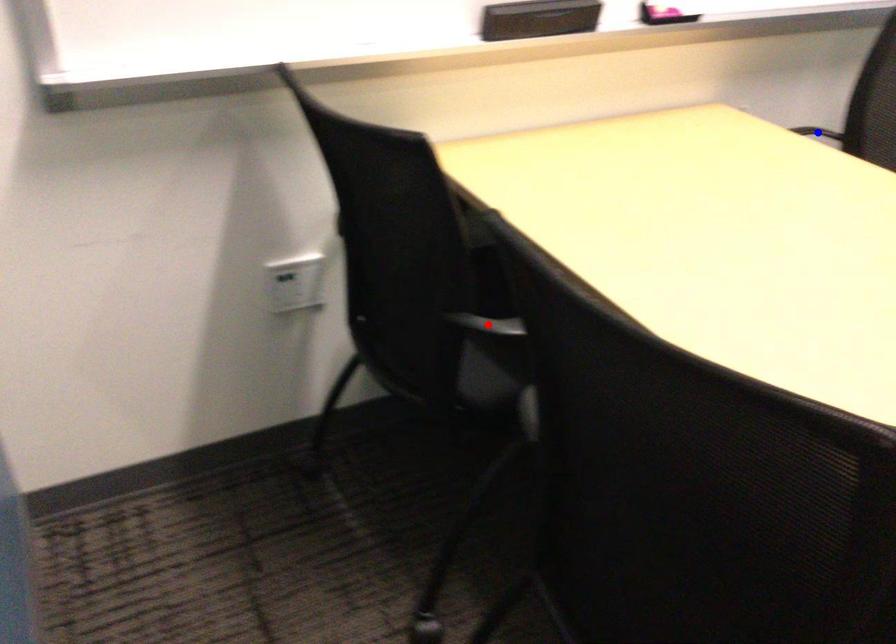
Question: Which of the two points in the image is closer to the camera?

Choices:
 (A) Blue point is closer.
 (B) Red point is closer.

Answer: (B)